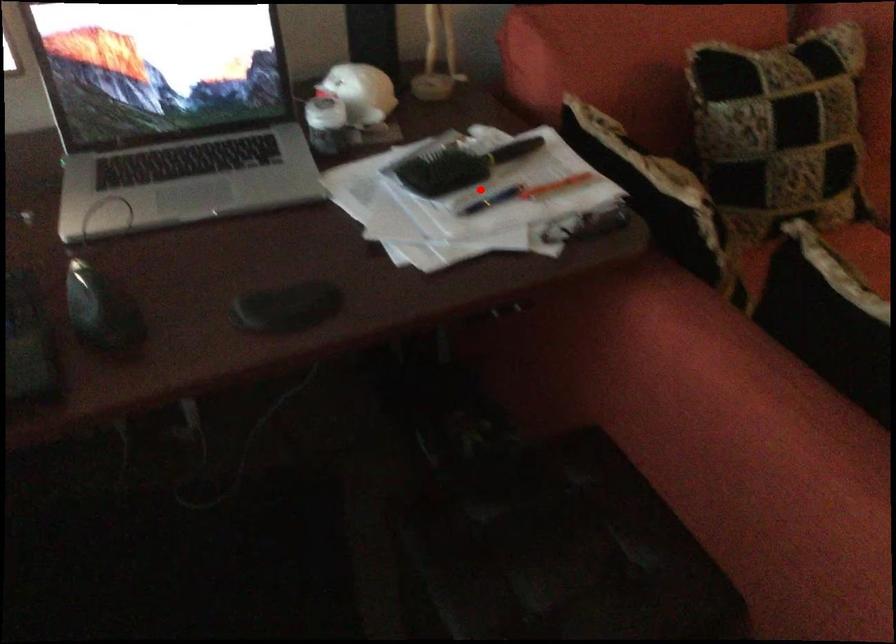
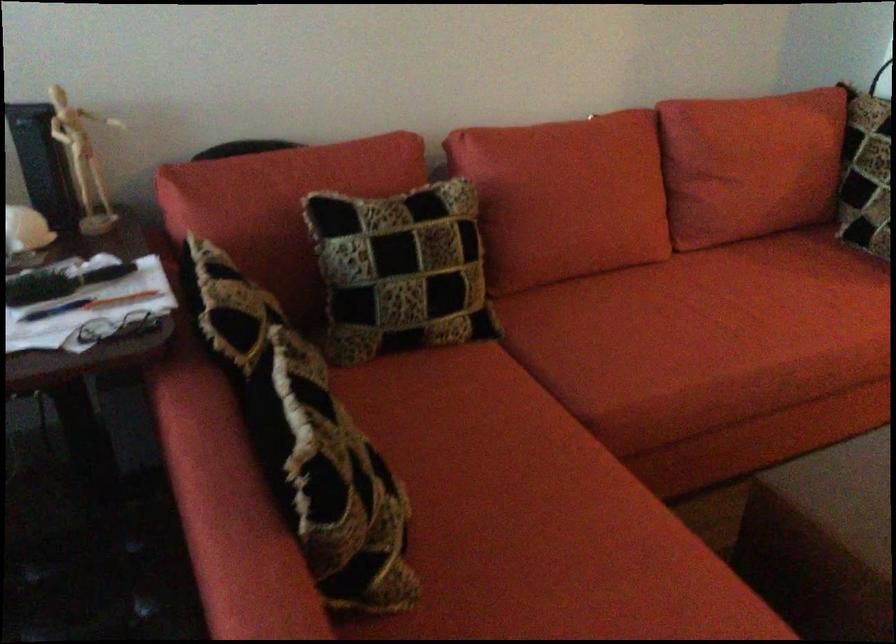
Question: I am providing you with two images of the same scene from different viewpoints. A red point is shown in image1. For the corresponding object point in image2, is it positioned nearer or farther from the camera?

Choices:
 (A) Nearer
 (B) Farther

Answer: (B)